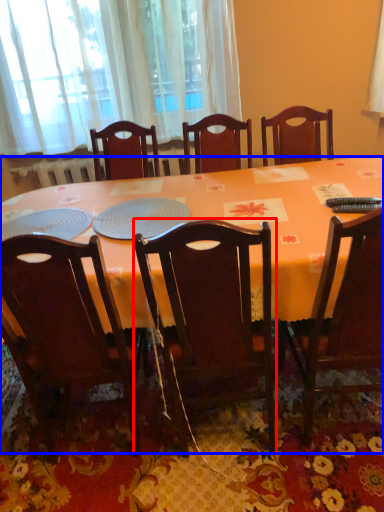
Question: Among these objects, which one is nearest to the camera, chair (highlighted by a red box) or desk (highlighted by a blue box)?

Choices:
 (A) chair
 (B) desk

Answer: (A)